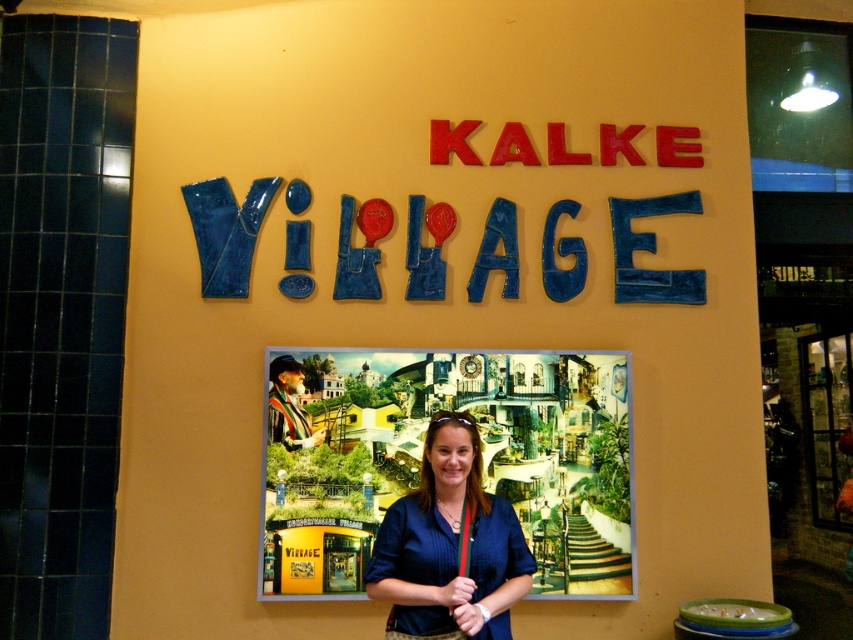
Does colorful painted poster at center lie in front of blue fabric shirt at center?

No, colorful painted poster at center is behind blue fabric shirt at center.

Who is more distant from viewer, (514, 456) or (498, 557)?

Positioned behind is point (514, 456).

Where is `colorful painted poster at center`? The width and height of the screenshot is (853, 640). colorful painted poster at center is located at coordinates (424, 460).